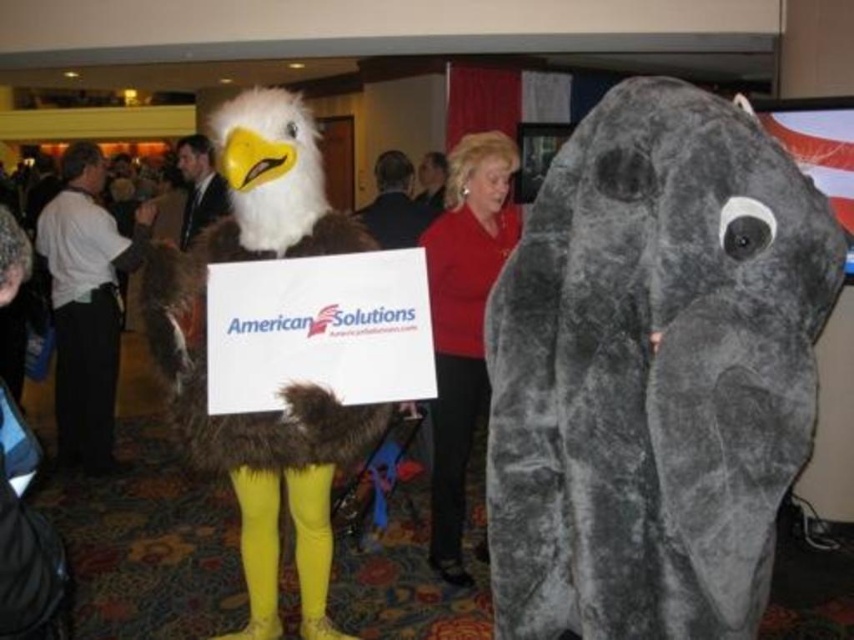
Question: From the image, what is the correct spatial relationship of fuzzy brown eagle at center in relation to white fur eagle at left?

Choices:
 (A) right
 (B) left

Answer: (A)

Question: Which point appears farthest from the camera in this image?

Choices:
 (A) (478, 147)
 (B) (185, 221)
 (C) (313, 172)
 (D) (711, 520)

Answer: (B)

Question: Is fuzzy brown eagle at center to the right of red fabric at center from the viewer's perspective?

Choices:
 (A) no
 (B) yes

Answer: (A)

Question: Among these points, which one is nearest to the camera?

Choices:
 (A) (92, 275)
 (B) (502, 476)
 (C) (303, 182)

Answer: (B)

Question: Which of the following is the farthest from the observer?

Choices:
 (A) fuzzy brown eagle at center
 (B) fuzzy gray elephant at right
 (C) white fur eagle at left
 (D) smooth suit at center

Answer: (D)

Question: Does fuzzy brown eagle at center have a larger size compared to smooth suit at center?

Choices:
 (A) no
 (B) yes

Answer: (B)